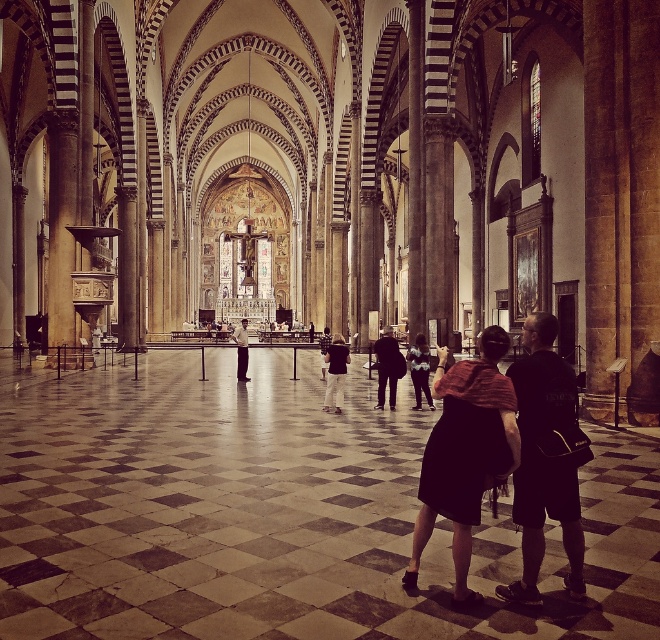
Measure the distance between dark gray fabric coat at center and camera.

dark gray fabric coat at center and camera are 49.83 meters apart.

Is dark gray fabric coat at center in front of matte black suit at center?

Yes, it is in front of matte black suit at center.

Between point (396, 388) and point (248, 378), which one is positioned behind?

Positioned behind is point (248, 378).

Where is `dark gray fabric coat at center`? This screenshot has width=660, height=640. dark gray fabric coat at center is located at coordinates (387, 365).

Who is more forward, [482,369] or [531,362]?

Point [482,369] is more forward.

Locate an element on the screen. This screenshot has width=660, height=640. dark brown fabric dress at center is located at coordinates (465, 452).

Looking at this image, between dark brown fabric dress at center and dark gray fabric coat at center, which one is positioned higher?

dark gray fabric coat at center is higher up.

Between dark brown fabric dress at center and dark gray fabric coat at center, which one has more height?

dark brown fabric dress at center

Between point (453, 396) and point (399, 362), which one is positioned in front?

Point (453, 396) is in front.

Identify the location of dark brown fabric dress at center. (465, 452).